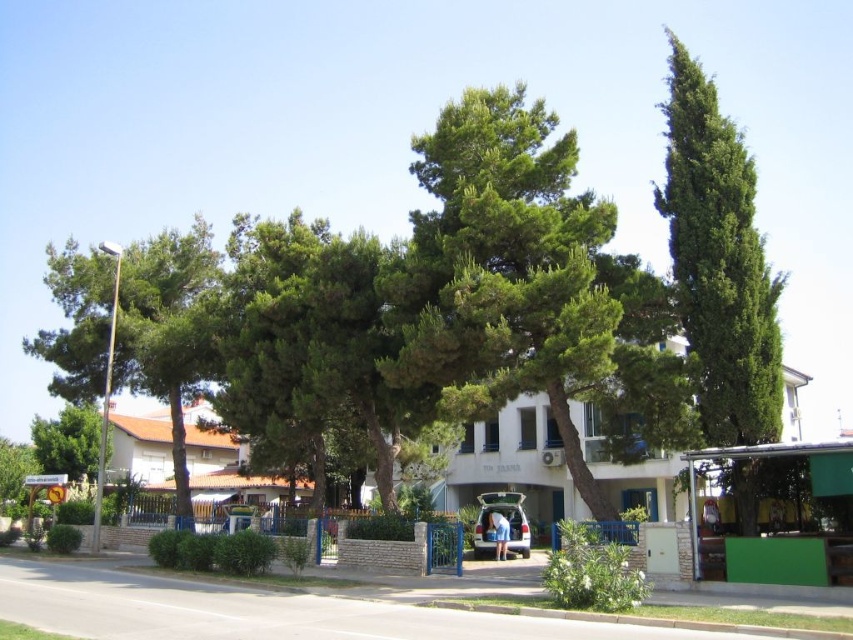
Question: Estimate the real-world distances between objects in this image. Which object is farther from the green leafy tree at lower left?

Choices:
 (A) green leafy tree at left
 (B) green coniferous tree at right

Answer: (B)

Question: Where is green coniferous tree at right located in relation to green leafy tree at left in the image?

Choices:
 (A) below
 (B) above

Answer: (B)

Question: Observing the image, what is the correct spatial positioning of green coniferous tree at right in reference to green leafy tree at lower left?

Choices:
 (A) above
 (B) below

Answer: (A)

Question: Which point is farther from the camera taking this photo?

Choices:
 (A) (695, 124)
 (B) (67, 268)
 (C) (38, 456)

Answer: (C)

Question: Among these points, which one is farthest from the camera?

Choices:
 (A) (122, 305)
 (B) (62, 452)

Answer: (B)

Question: Does green leafy tree at left appear on the left side of green leafy tree at lower left?

Choices:
 (A) yes
 (B) no

Answer: (B)